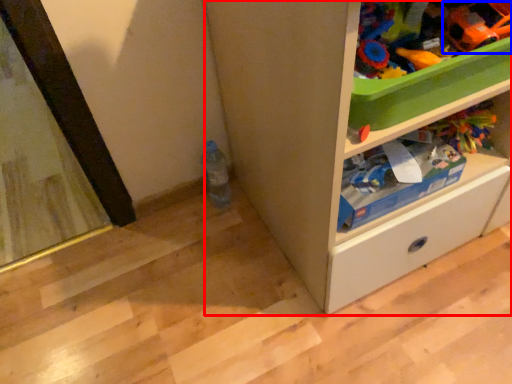
Question: Among these objects, which one is farthest to the camera, cabinetry (highlighted by a red box) or toy (highlighted by a blue box)?

Choices:
 (A) cabinetry
 (B) toy

Answer: (B)